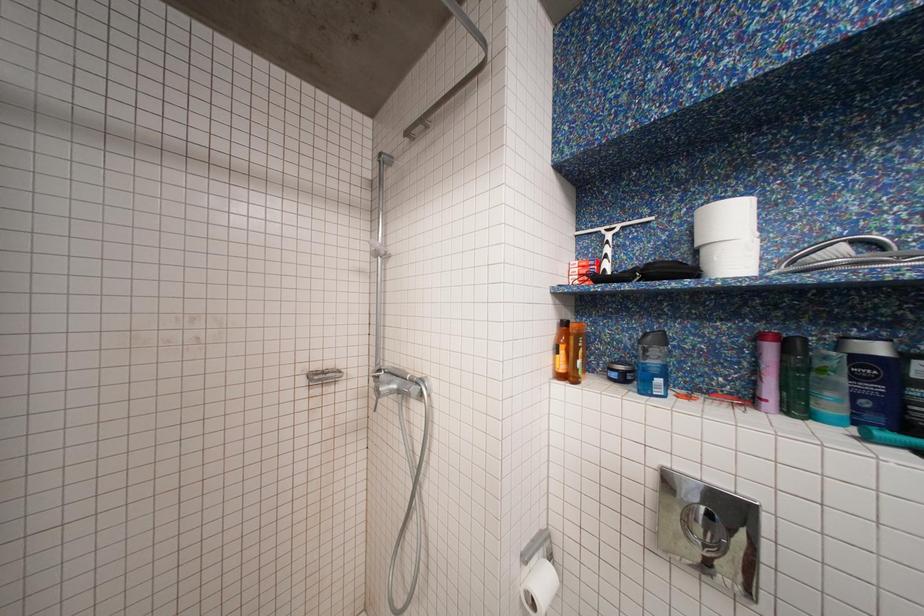
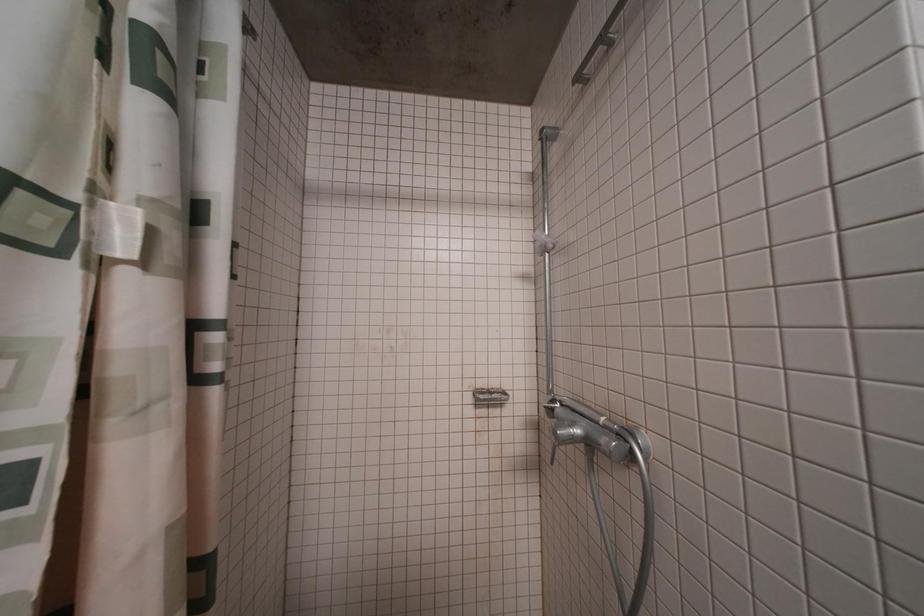
Question: The camera is either moving clockwise (left) or counter-clockwise (right) around the object. The first image is from the beginning of the video and the second image is from the end. Is the camera moving left or right when shooting the video?

Choices:
 (A) Left
 (B) Right

Answer: (B)